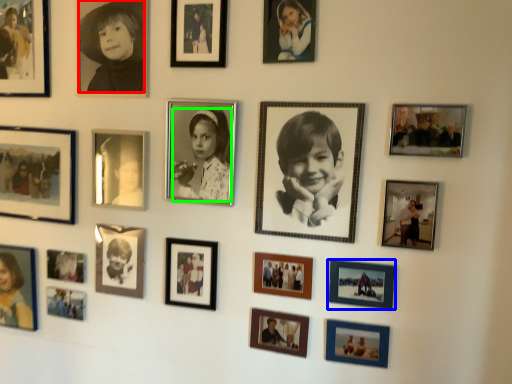
Question: Considering the real-world distances, which object is closest to person (highlighted by a red box)? picture frame (highlighted by a blue box) or person (highlighted by a green box).

Choices:
 (A) picture frame
 (B) person

Answer: (B)